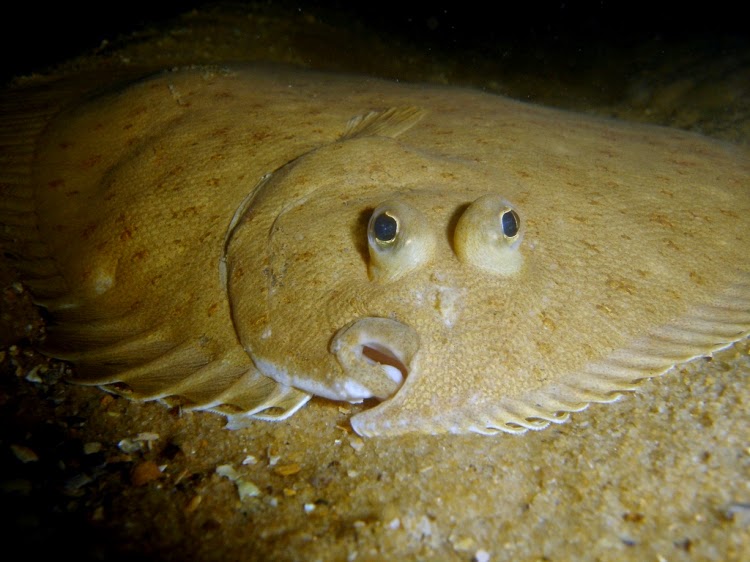
What are the coordinates of `scales` in the screenshot? It's located at (600, 271).